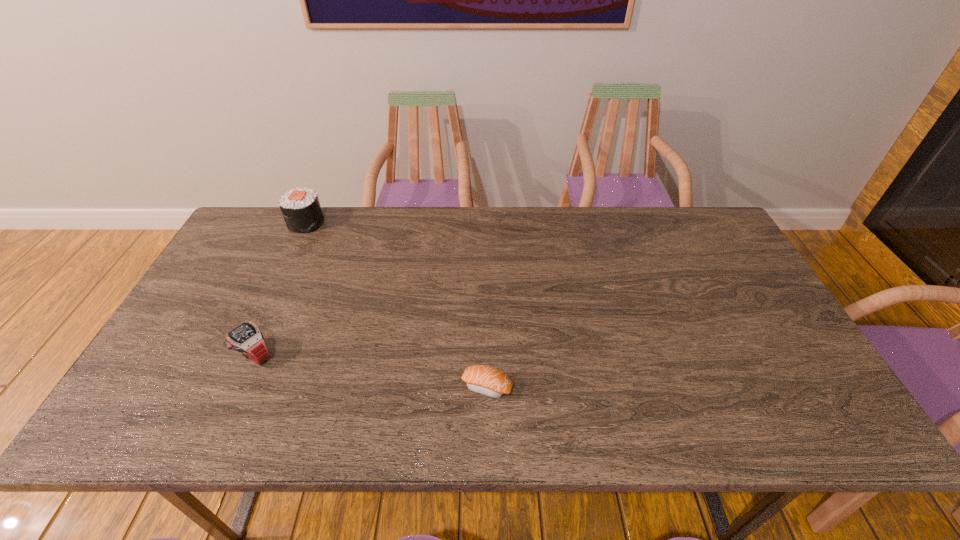
At what (x,y) coordinates should I click in order to perform the action: click on the farthest object. Please return your answer as a coordinate pair (x, y). Looking at the image, I should click on (301, 209).

You are a GUI agent. You are given a task and a screenshot of the screen. Output one action in this format:
    pyautogui.click(x=<x>, y=<y>)
    Task: Click on the taller sushi
    This screenshot has width=960, height=540.
    Given the screenshot: What is the action you would take?
    pyautogui.click(x=301, y=209)

Locate an element on the screen. the second shortest object is located at coordinates (246, 338).

This screenshot has width=960, height=540. Find the location of `watch`. watch is located at coordinates (246, 338).

This screenshot has height=540, width=960. Identify the location of the shortest object. (485, 380).

I want to click on the nearest object, so click(x=485, y=380).

I want to click on vacant position located 0.190m on the front of the taller sushi, so click(282, 274).

This screenshot has height=540, width=960. In order to click on vacant space located on the right of the watch in this screenshot , I will do `click(328, 355)`.

This screenshot has width=960, height=540. I want to click on vacant region located on the left of the rightmost object, so click(x=354, y=387).

The height and width of the screenshot is (540, 960). I want to click on object present at the far edge, so click(x=301, y=209).